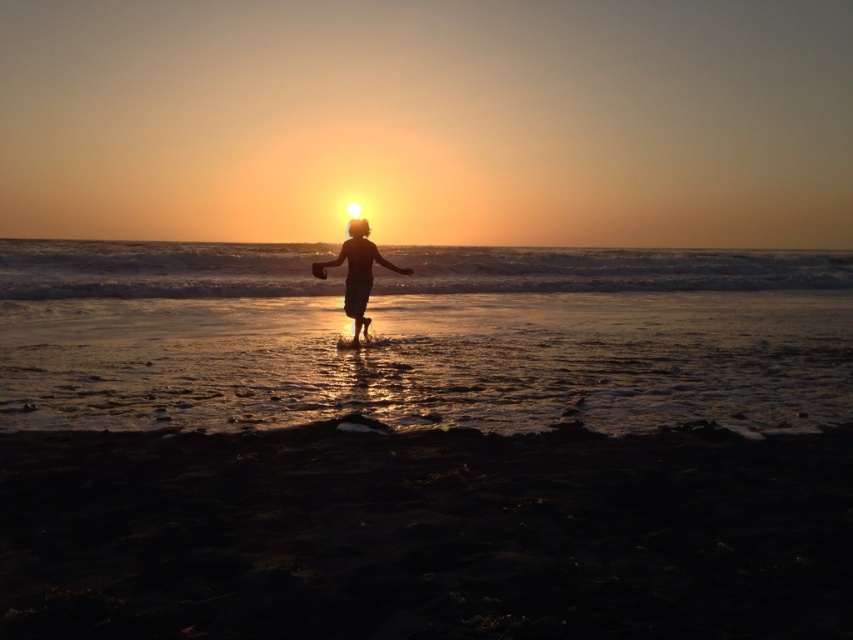
You are a photographer trying to capture the sunset scene. You notice the dark sand at lower center and the silhouette wooden stick at center. Which object appears taller in the photo?

The silhouette wooden stick at center appears taller than the dark sand at lower center in the photo.

You are a photographer trying to capture the sunset scene. You notice two points in the image at coordinates point (x=238, y=244) and point (x=347, y=273). Which point is closer to your camera lens?

Point (x=238, y=244) is further to the camera than point (x=347, y=273), so the point closer to the camera lens is point (x=238, y=244).

You are a photographer trying to capture the sunset scene. You want to place a wooden stick in the sand so that it appears to the left of the dark sand area in your photo. Based on the scene, where should you place the silhouette wooden stick at center relative to the dark sand at lower center?

The dark sand at lower center is positioned on the right side of the silhouette wooden stick at center, so to have the stick appear to the left of the dark sand area, place the silhouette wooden stick at center to the left of the dark sand at lower center.